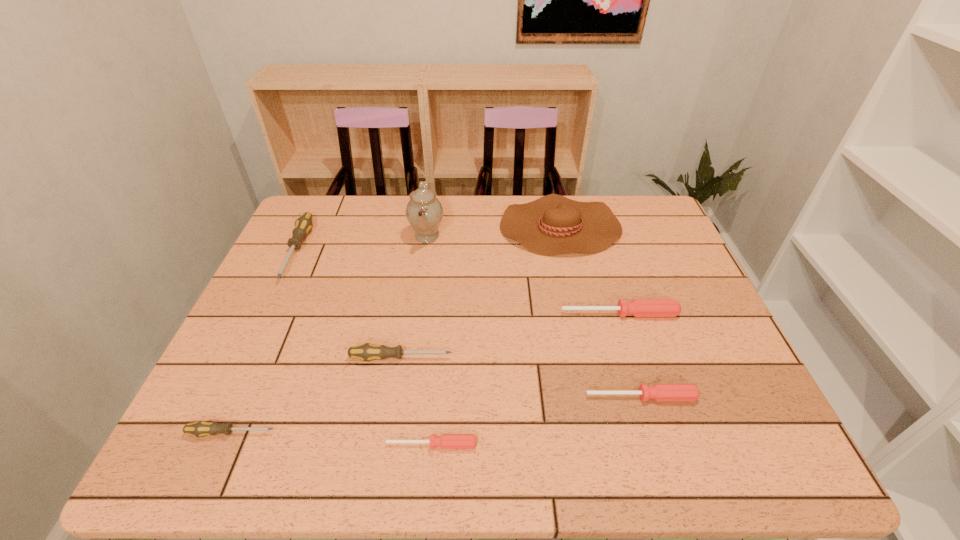
Locate an element on the screen. free location located 0.380m on the left of the shortest object is located at coordinates (196, 444).

What are the coordinates of `chinaware that is at the far edge` in the screenshot? It's located at (424, 212).

Where is `cowboy hat that is at the far edge`? This screenshot has width=960, height=540. cowboy hat that is at the far edge is located at coordinates click(553, 224).

This screenshot has width=960, height=540. I want to click on screwdriver that is positioned at the far edge, so click(303, 225).

The width and height of the screenshot is (960, 540). Find the location of `cowboy hat that is at the right edge`. cowboy hat that is at the right edge is located at coordinates (553, 224).

What are the coordinates of `object located at the far left corner` in the screenshot? It's located at (303, 225).

This screenshot has width=960, height=540. What are the coordinates of `object located at the near left corner` in the screenshot? It's located at (202, 428).

What are the coordinates of `object present at the far right corner` in the screenshot? It's located at (x=553, y=224).

You are a GUI agent. You are given a task and a screenshot of the screen. Output one action in this format:
    pyautogui.click(x=<x>, y=<y>)
    Task: Click on the vacant space at the far edge of the desktop
    
    Given the screenshot: What is the action you would take?
    pyautogui.click(x=380, y=219)

The image size is (960, 540). In the image, there is a desktop. Find the location of `vacant space at the near edge`. vacant space at the near edge is located at coordinates (547, 443).